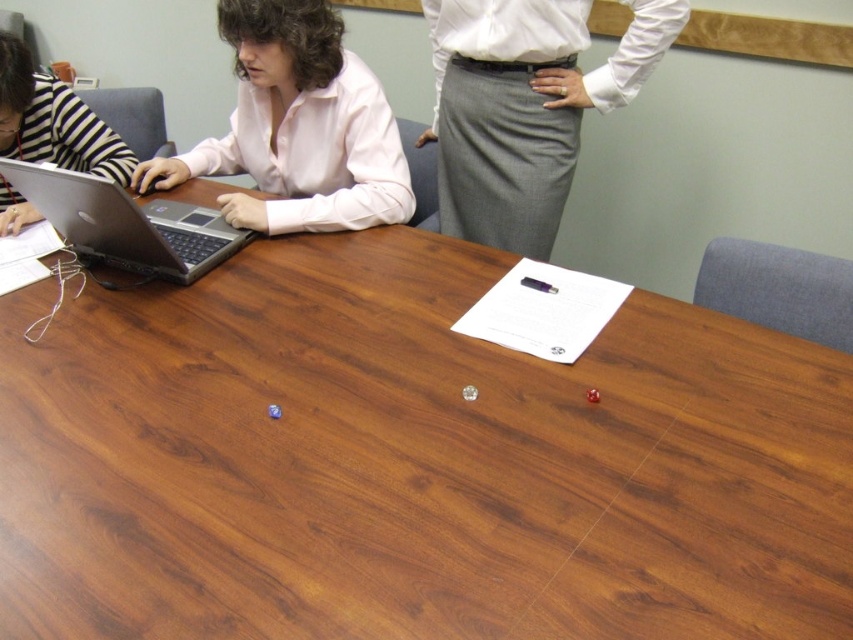
Does gray wool skirt at upper center have a lesser width compared to matte pink shirt at upper left?

Indeed, gray wool skirt at upper center has a lesser width compared to matte pink shirt at upper left.

Between gray wool skirt at upper center and matte pink shirt at upper left, which one appears on the right side from the viewer's perspective?

gray wool skirt at upper center is more to the right.

Between point (490, 44) and point (236, 163), which one is positioned in front?

Point (490, 44) is more forward.

Image resolution: width=853 pixels, height=640 pixels. In order to click on gray wool skirt at upper center in this screenshot , I will do `click(524, 108)`.

Between wooden table at center and striped fabric person at left, which one appears on the right side from the viewer's perspective?

wooden table at center

Is wooden table at center below striped fabric person at left?

Yes, wooden table at center is below striped fabric person at left.

Does point (13, 476) lie behind point (4, 193)?

That is False.

Locate an element on the screen. wooden table at center is located at coordinates (410, 461).

Is silver metallic laptop at left above striped fabric person at left?

No.

Is the position of silver metallic laptop at left less distant than that of striped fabric person at left?

That is True.

Between point (200, 220) and point (59, 112), which one is positioned behind?

The point (59, 112) is more distant.

Where is `silver metallic laptop at left`? silver metallic laptop at left is located at coordinates (126, 224).